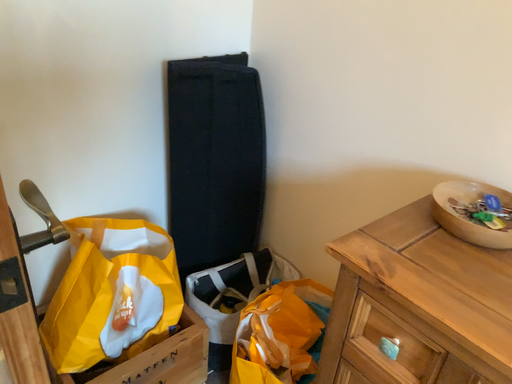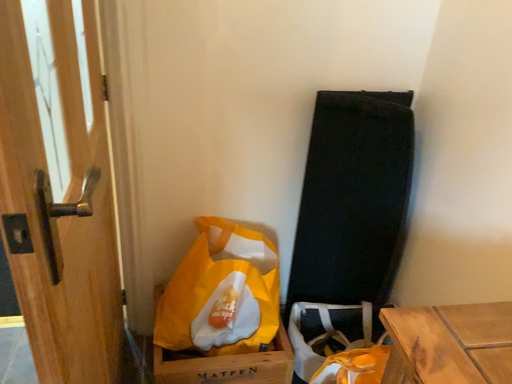
Question: How did the camera likely rotate when shooting the video?

Choices:
 (A) rotated upward
 (B) rotated downward

Answer: (A)